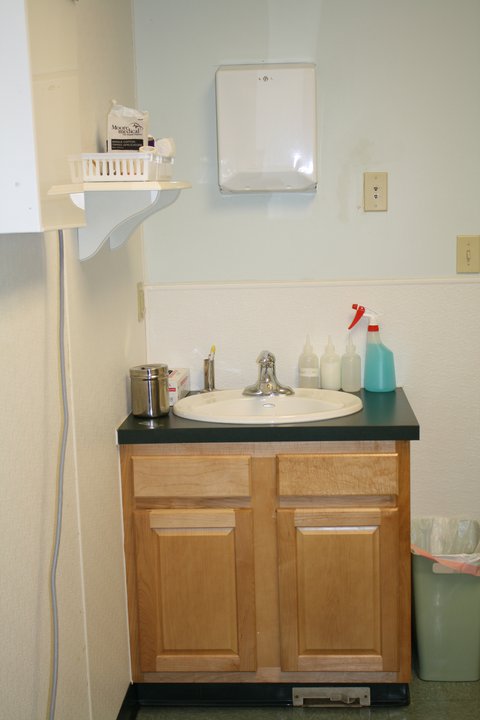
Image resolution: width=480 pixels, height=720 pixels. Identify the location of floor. (455, 702).